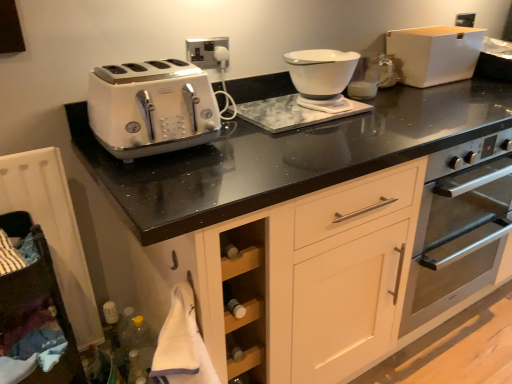
Question: In the image, is white glossy bowl at upper center positioned in front of or behind white glossy bowl at center?

Choices:
 (A) behind
 (B) front

Answer: (A)

Question: From a real-world perspective, is white glossy bowl at upper center physically located above or below white glossy bowl at center?

Choices:
 (A) above
 (B) below

Answer: (B)

Question: Which object is positioned farthest from the white matte storage box at upper right?

Choices:
 (A) white wood cabinet at lower left
 (B) white glossy bowl at upper center
 (C) white glossy toaster at left
 (D) white glossy bowl at center

Answer: (A)

Question: Estimate the real-world distances between objects in this image. Which object is closer to the white glossy toaster at left?

Choices:
 (A) white matte storage box at upper right
 (B) white glossy bowl at upper center
 (C) white glossy bowl at center
 (D) white wood cabinet at lower left

Answer: (D)